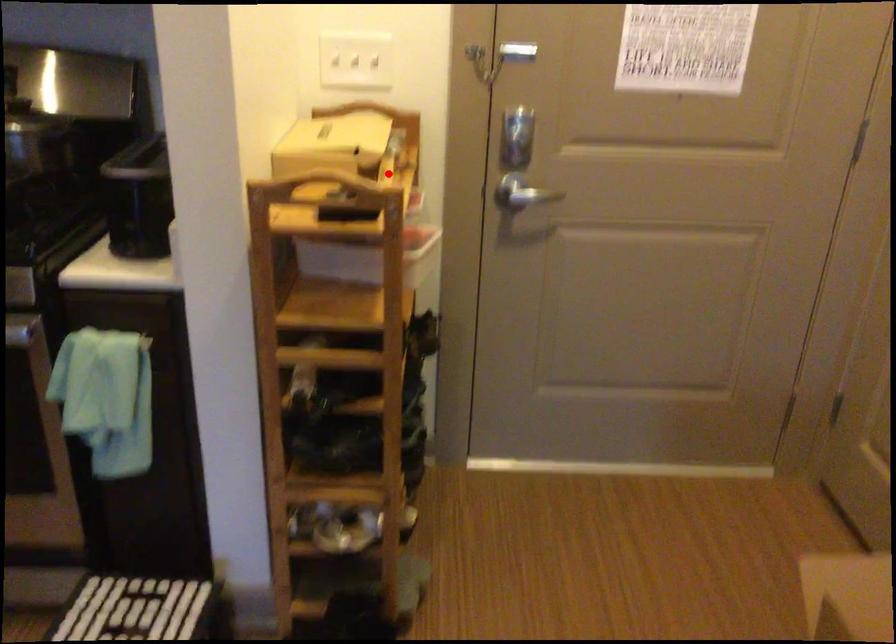
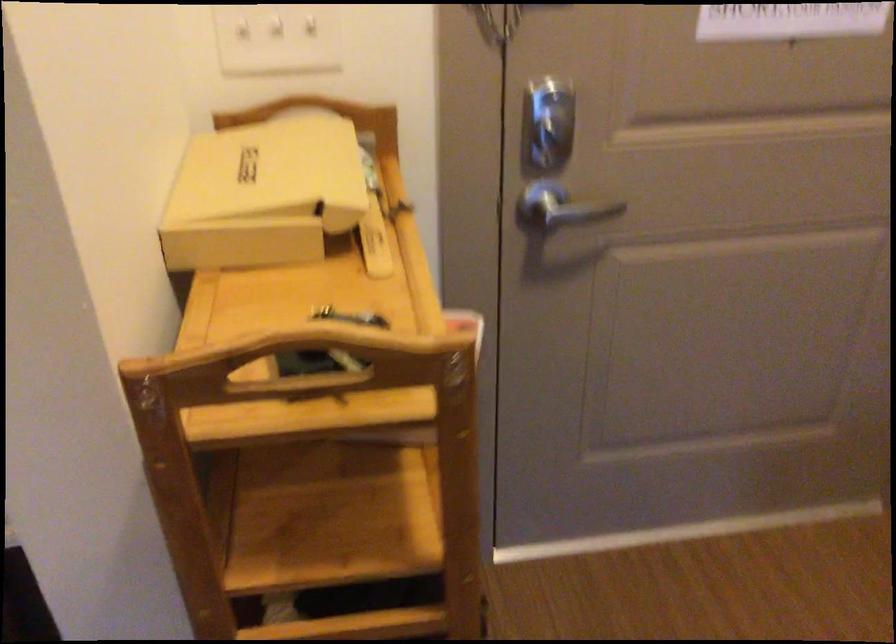
In the second image, find the point that corresponds to the highlighted location in the first image.

(375, 242)